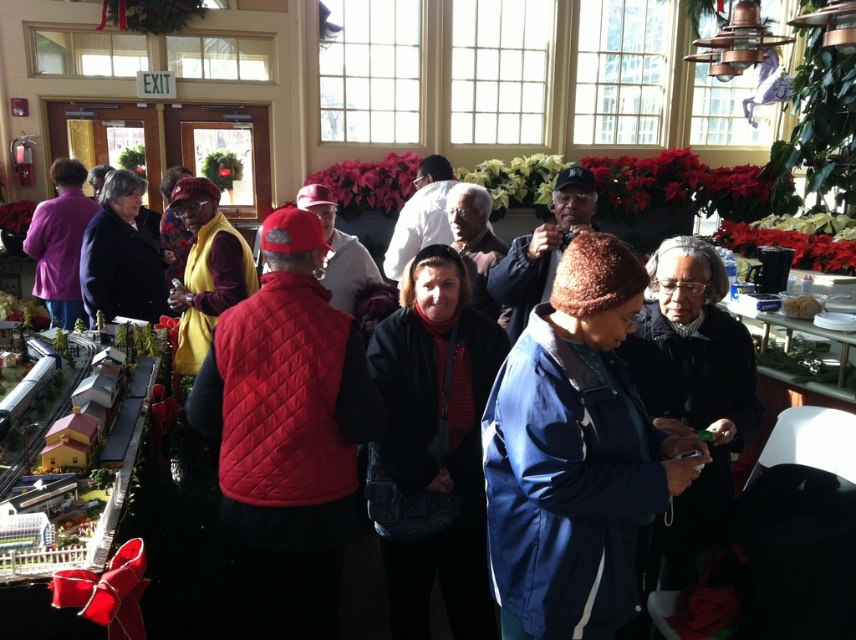
You are standing in the room and want to move from point (51, 204) to point (794, 301). Which direction should you face to walk towards your destination?

You should face towards the upper right direction because point (794, 301) is located at upper right compared to point (51, 204).

Please look at the point at coordinates [60,243]. What object is located there?

The object at point [60,243] is the matte purple jacket at left.

You are organizing a small event and need to place a decorative bread on a table. The table has a space that can only accommodate items smaller than the matte purple jacket at left. Can the white fluffy bread at center fit in that space?

The white fluffy bread at center is smaller than the matte purple jacket at left, so it can fit in the space designated for items smaller than the matte purple jacket at left.